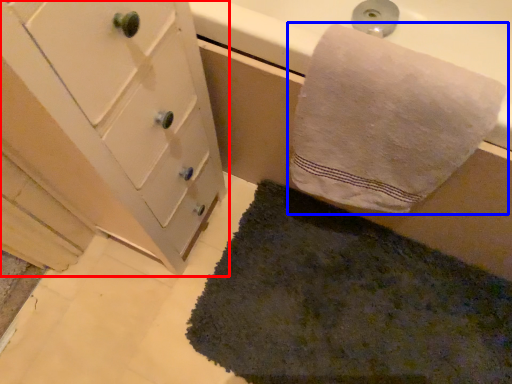
Question: Among these objects, which one is farthest to the camera, bathroom cabinet (highlighted by a red box) or towel (highlighted by a blue box)?

Choices:
 (A) bathroom cabinet
 (B) towel

Answer: (B)